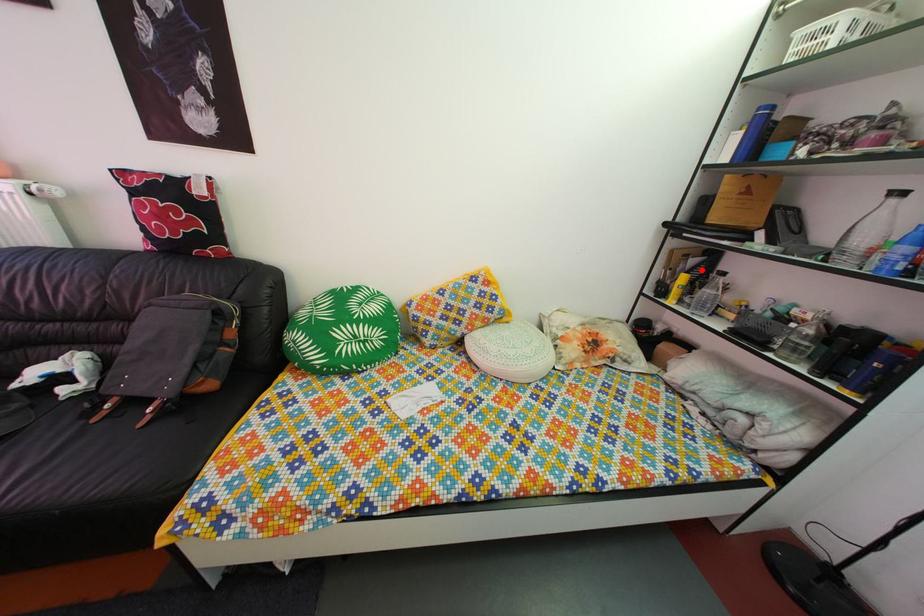
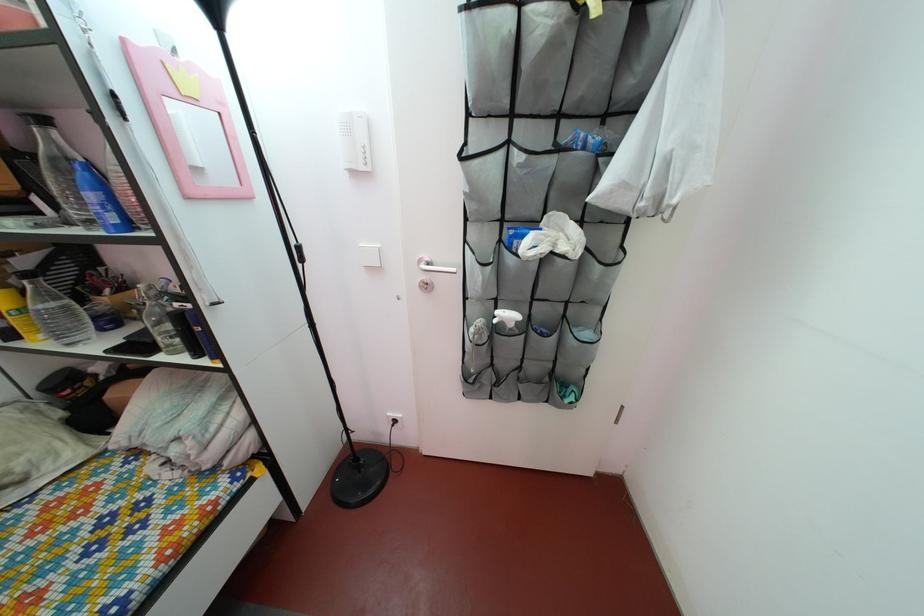
Question: I am providing you with two images of the same scene from different viewpoints. A red point is marked on the first image. Is the red point's position out of view in image 2?

Choices:
 (A) Yes
 (B) No

Answer: (B)